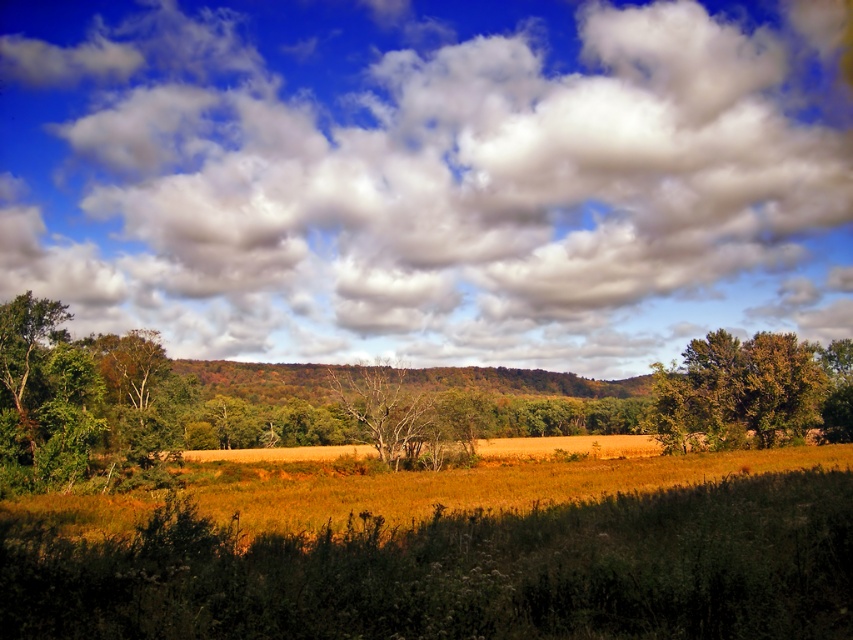
Question: Based on their relative distances, which object is farther from the bare wood tree at center?

Choices:
 (A) green leafy tree at right
 (B) white fluffy cloud at upper center

Answer: (B)

Question: Does white fluffy cloud at upper center have a lesser width compared to green leafy tree at right?

Choices:
 (A) yes
 (B) no

Answer: (B)

Question: Can you confirm if white fluffy cloud at upper center is positioned to the left of green leafy tree at right?

Choices:
 (A) no
 (B) yes

Answer: (B)

Question: Which point is closer to the camera?

Choices:
 (A) green leafy tree at right
 (B) white fluffy cloud at upper center
 (C) bare wood tree at center

Answer: (B)

Question: Can you confirm if white fluffy cloud at upper center is positioned to the right of green leafy tree at right?

Choices:
 (A) yes
 (B) no

Answer: (B)

Question: Which point is closer to the camera?

Choices:
 (A) (660, 426)
 (B) (303, 237)

Answer: (A)